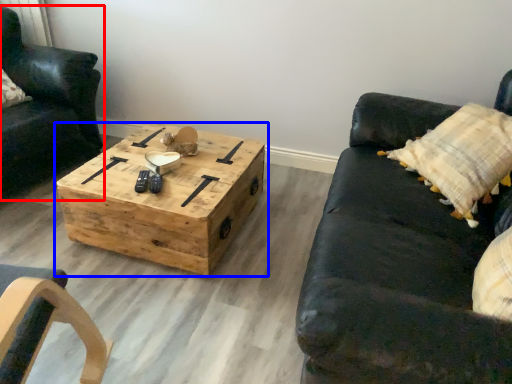
Question: Which object is closer to the camera taking this photo, chair (highlighted by a red box) or coffee table (highlighted by a blue box)?

Choices:
 (A) chair
 (B) coffee table

Answer: (B)